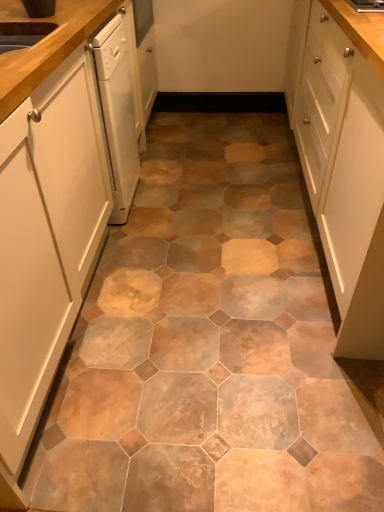
Question: Does point (334, 222) appear closer or farther from the camera than point (19, 117)?

Choices:
 (A) farther
 (B) closer

Answer: (A)

Question: Is white matte cabinet at right, positioned as the 2th cabinetry in left-to-right order, spatially inside white matte cabinet at left, arranged as the first cabinetry when viewed from the left, or outside of it?

Choices:
 (A) inside
 (B) outside

Answer: (B)

Question: Relative to white matte cabinet at left, the 2th cabinetry positioned from the right, is white matte cabinet at right, positioned as the 2th cabinetry in left-to-right order, in front or behind?

Choices:
 (A) front
 (B) behind

Answer: (B)

Question: Does point (36, 53) appear closer or farther from the camera than point (375, 350)?

Choices:
 (A) farther
 (B) closer

Answer: (B)

Question: Relative to white matte cabinet at right, positioned as the 2th cabinetry in left-to-right order, is white matte cabinet at left, the 2th cabinetry positioned from the right, in front or behind?

Choices:
 (A) front
 (B) behind

Answer: (A)

Question: From the image's perspective, relative to white matte cabinet at right, positioned as the first cabinetry in right-to-left order, is white matte cabinet at left, the 2th cabinetry positioned from the right, above or below?

Choices:
 (A) above
 (B) below

Answer: (B)

Question: From a real-world perspective, is white matte cabinet at left, the 2th cabinetry positioned from the right, positioned above or below white matte cabinet at right, positioned as the 2th cabinetry in left-to-right order?

Choices:
 (A) below
 (B) above

Answer: (A)